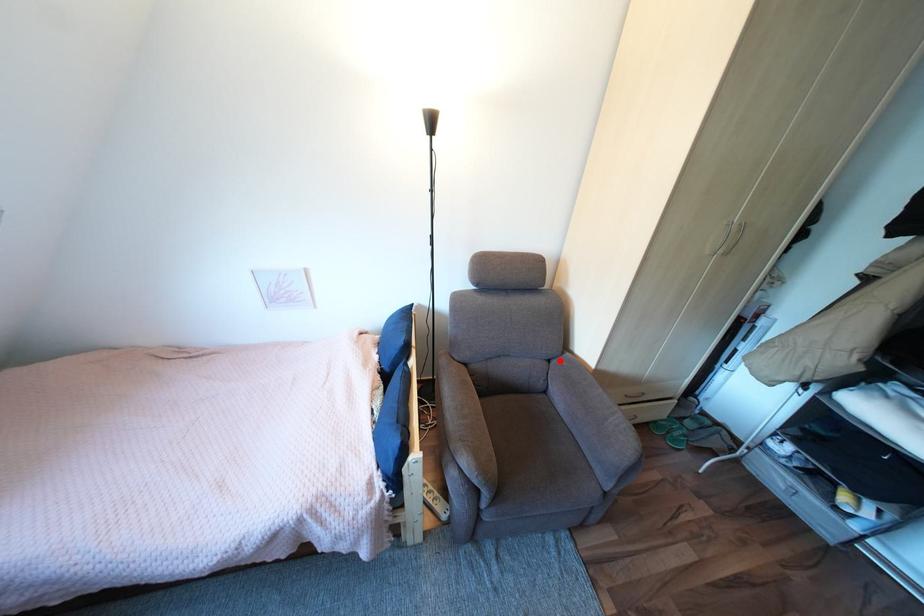
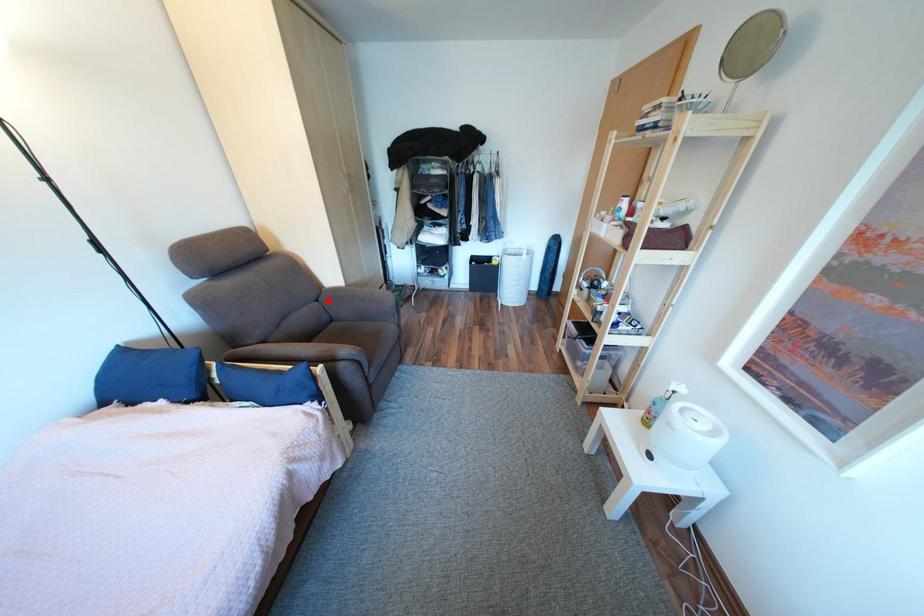
I am providing you with two images of the same scene from different viewpoints. A red point is marked on the first image and another point is marked on the second image. Does the point marked in image1 correspond to the same location as the one in image2?

Yes